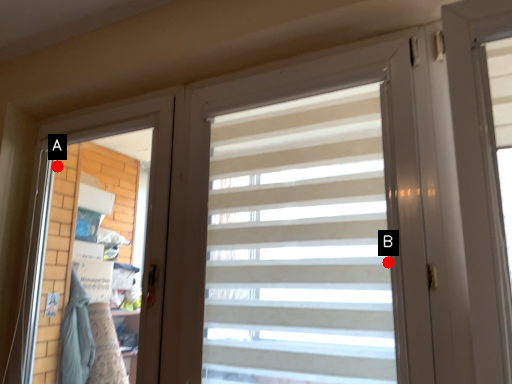
Question: Two points are circled on the image, labeled by A and B beside each circle. Which point is farther to the camera?

Choices:
 (A) A is further
 (B) B is further

Answer: (A)